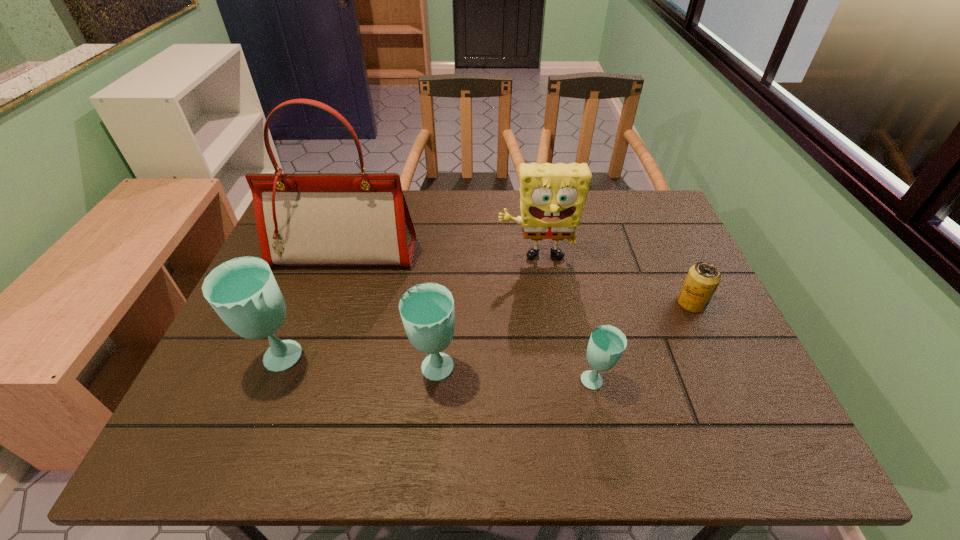
I want to click on free space between the tallest object and the leftmost glass, so click(312, 308).

You are a GUI agent. You are given a task and a screenshot of the screen. Output one action in this format:
    pyautogui.click(x=<x>, y=<y>)
    Task: Click on the vacant area between the third object from left to right and the tallest object
    The height and width of the screenshot is (540, 960).
    Given the screenshot: What is the action you would take?
    pyautogui.click(x=390, y=313)

Where is `vacant point located between the third object from left to right and the tallest object`? The image size is (960, 540). vacant point located between the third object from left to right and the tallest object is located at coordinates (390, 313).

Locate an element on the screen. This screenshot has width=960, height=540. free area in between the second shortest object and the fourth nearest object is located at coordinates (644, 342).

I want to click on blank region between the sponge and the second glass from right to left, so click(486, 315).

Identify which object is located as the third nearest to the leftmost glass. Please provide its 2D coordinates. Your answer should be formatted as a tuple, i.e. [(x, y)], where the tuple contains the x and y coordinates of a point satisfying the conditions above.

[(552, 196)]

Identify which object is the second nearest to the shortest glass. Please provide its 2D coordinates. Your answer should be formatted as a tuple, i.e. [(x, y)], where the tuple contains the x and y coordinates of a point satisfying the conditions above.

[(703, 278)]

Locate which glass ranks second in proximity to the second shortest glass. Please provide its 2D coordinates. Your answer should be formatted as a tuple, i.e. [(x, y)], where the tuple contains the x and y coordinates of a point satisfying the conditions above.

[(607, 343)]

What are the coordinates of `glass that is the second nearest to the handbag` in the screenshot? It's located at (427, 310).

Locate an element on the screen. vacant space that satisfies the following two spatial constraints: 1. on the front side of the rightmost glass; 2. on the right side of the leftmost glass is located at coordinates pos(272,381).